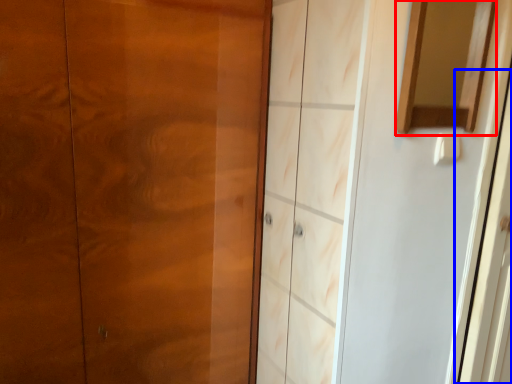
Question: Which object appears farthest to the camera in this image, mirror (highlighted by a red box) or screen door (highlighted by a blue box)?

Choices:
 (A) mirror
 (B) screen door

Answer: (B)